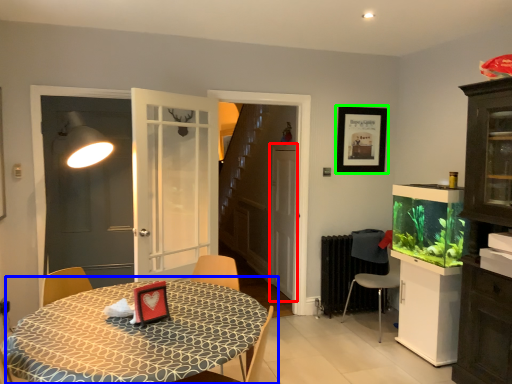
Question: Based on their relative distances, which object is farther from screen door (highlighted by a red box)? Choose from table (highlighted by a blue box) and picture frame (highlighted by a green box).

Choices:
 (A) table
 (B) picture frame

Answer: (A)